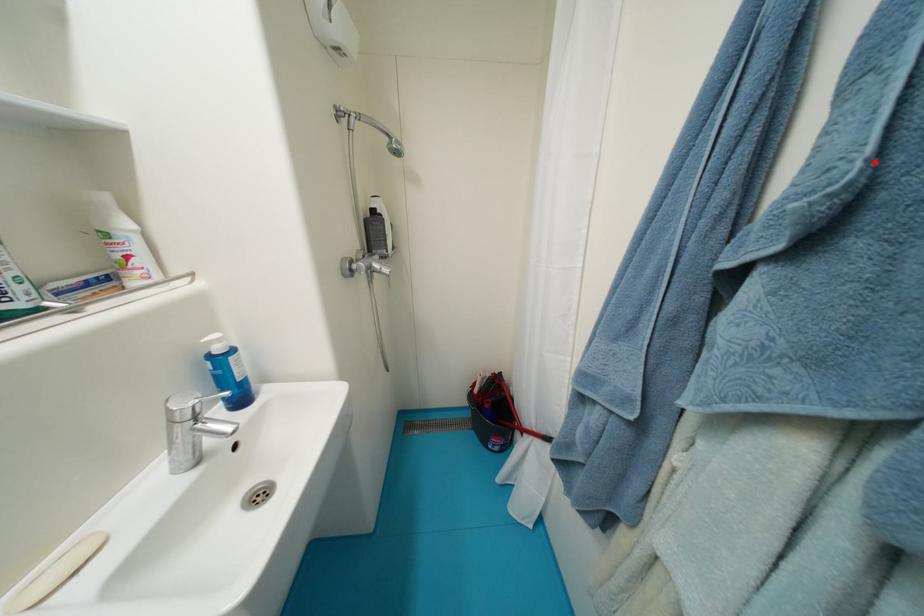
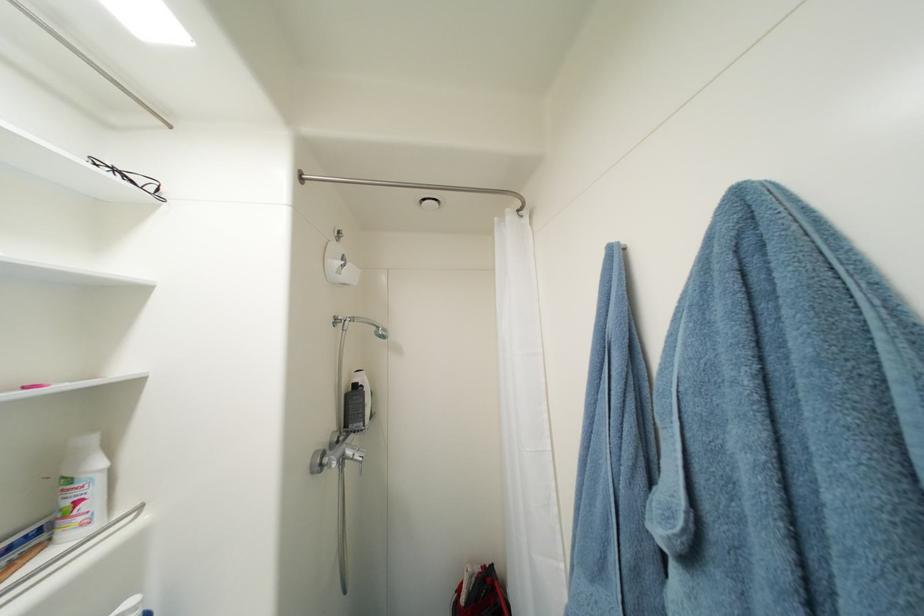
Locate, in the second image, the point that corresponds to the highlighted location in the first image.

(691, 515)